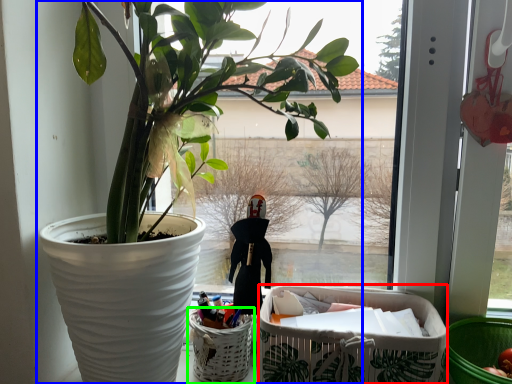
Question: Which object is the closest to the shopping basket (highlighted by a red box)? Choose among these: houseplant (highlighted by a blue box) or basket (highlighted by a green box).

Choices:
 (A) houseplant
 (B) basket

Answer: (B)